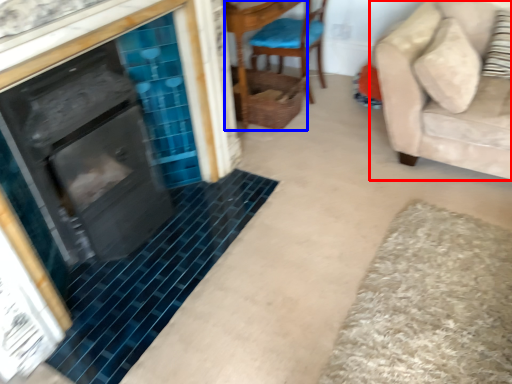
Question: Which of the following is the closest to the observer, studio couch (highlighted by a red box) or side table (highlighted by a blue box)?

Choices:
 (A) studio couch
 (B) side table

Answer: (A)